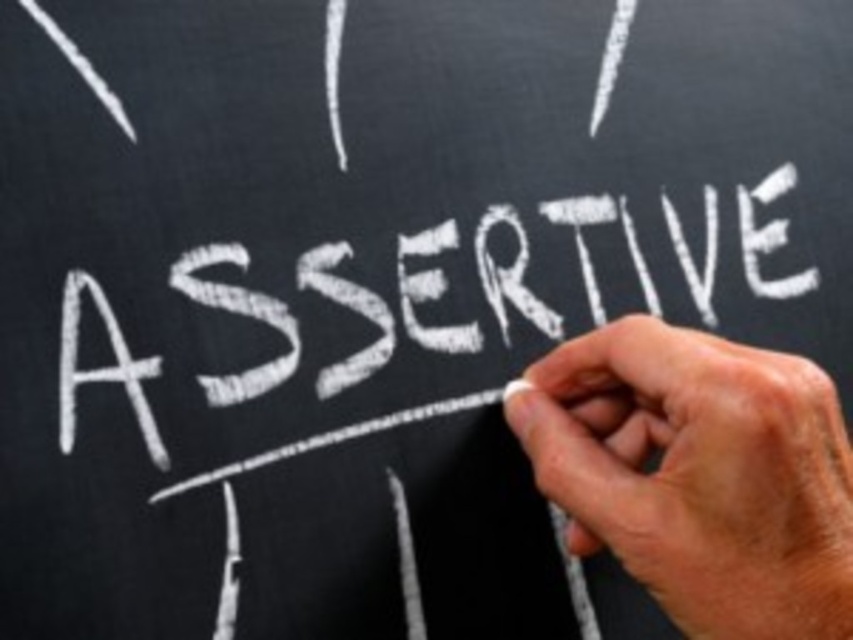
Question: Which object is farther from the camera taking this photo?

Choices:
 (A) dry chalk at center
 (B) white chalk writing at center

Answer: (B)

Question: Is dry chalk at center smaller than white chalk writing at center?

Choices:
 (A) no
 (B) yes

Answer: (B)

Question: Which object is closer to the camera taking this photo?

Choices:
 (A) white chalk writing at center
 (B) dry chalk at center

Answer: (B)

Question: Does dry chalk at center have a smaller size compared to white chalk writing at center?

Choices:
 (A) yes
 (B) no

Answer: (A)

Question: Among these points, which one is nearest to the camera?

Choices:
 (A) (392, 326)
 (B) (589, 548)

Answer: (B)

Question: Is dry chalk at center wider than white chalk writing at center?

Choices:
 (A) no
 (B) yes

Answer: (A)